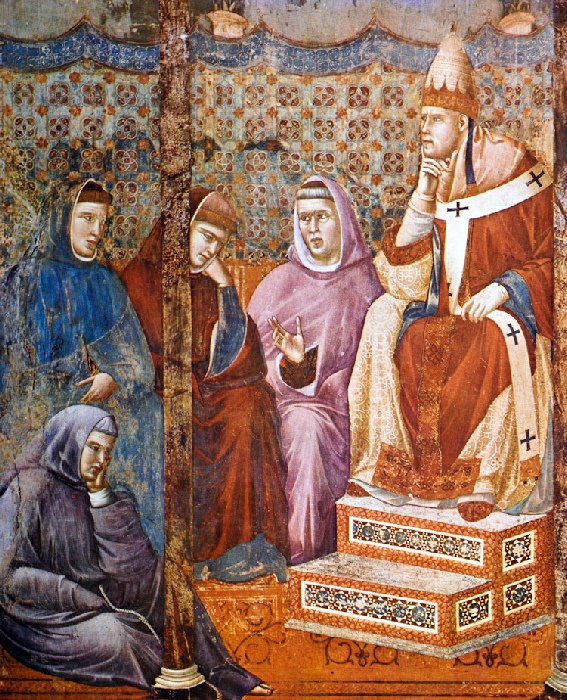
Locate an element on the screen. This screenshot has height=700, width=567. blue robe is located at coordinates (79, 323).